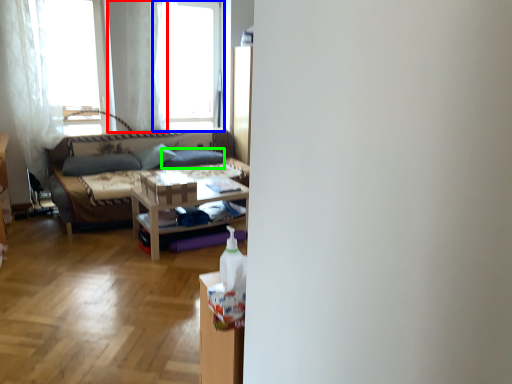
Question: Which object is the farthest from curtain (highlighted by a red box)? Choose among these: window (highlighted by a blue box) or pillow (highlighted by a green box).

Choices:
 (A) window
 (B) pillow

Answer: (B)